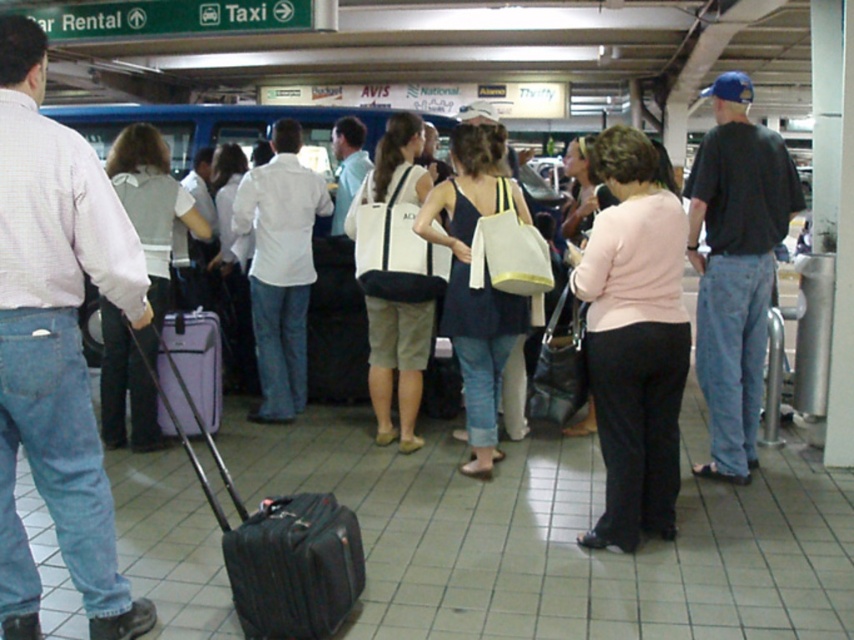
Question: Which point is closer to the camera taking this photo?

Choices:
 (A) (654, 492)
 (B) (341, 394)

Answer: (A)

Question: Which object is farther from the camera taking this photo?

Choices:
 (A) black fabric suitcase at center
 (B) black leather suitcase at center
 (C) light pink sweater at center

Answer: (B)

Question: From the image, what is the correct spatial relationship of light pink sweater at center in relation to black leather suitcase at center?

Choices:
 (A) below
 (B) above

Answer: (B)

Question: Which of the following is the farthest from the observer?

Choices:
 (A) black leather suitcase at center
 (B) light pink sweater at center

Answer: (A)

Question: Does light pink sweater at center have a larger size compared to black fabric suitcase at center?

Choices:
 (A) yes
 (B) no

Answer: (A)

Question: Can you confirm if light pink sweater at center is positioned to the left of black fabric suitcase at center?

Choices:
 (A) no
 (B) yes

Answer: (A)